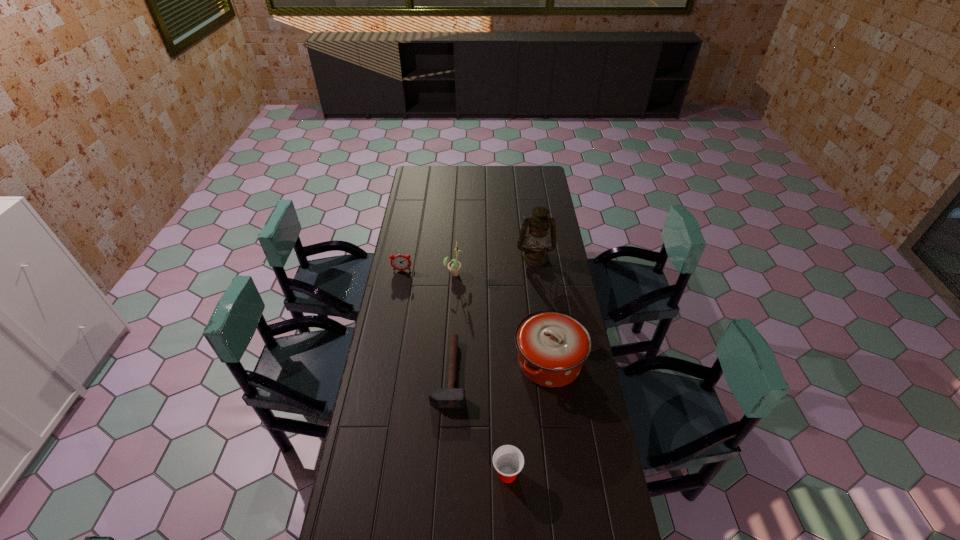
You are a GUI agent. You are given a task and a screenshot of the screen. Output one action in this format:
    pyautogui.click(x=<x>, y=<y>)
    Task: Click on the tallest object
    
    Given the screenshot: What is the action you would take?
    pyautogui.click(x=535, y=254)

Where is `oil lamp`? Image resolution: width=960 pixels, height=540 pixels. oil lamp is located at coordinates pyautogui.click(x=535, y=254).

Identify the location of sunflower. (454, 266).

This screenshot has height=540, width=960. I want to click on casserole, so click(x=552, y=346).

Find the location of a particular element. This screenshot has width=960, height=540. the leftmost object is located at coordinates (399, 262).

Where is `the nearest object`? The height and width of the screenshot is (540, 960). the nearest object is located at coordinates (508, 460).

At what (x,y) coordinates should I click in order to perform the action: click on the shortest object. Please return your answer as a coordinate pair (x, y). The image size is (960, 540). Looking at the image, I should click on (451, 397).

Locate an element on the screen. vacant area situated on the back of the oil lamp is located at coordinates (532, 228).

Identify the location of free space located on the front-facing side of the sunflower. (493, 273).

At what (x,y) coordinates should I click in order to perform the action: click on vacant region located 0.210m on the left of the casserole. Please return your answer as a coordinate pair (x, y). Looking at the image, I should click on (459, 362).